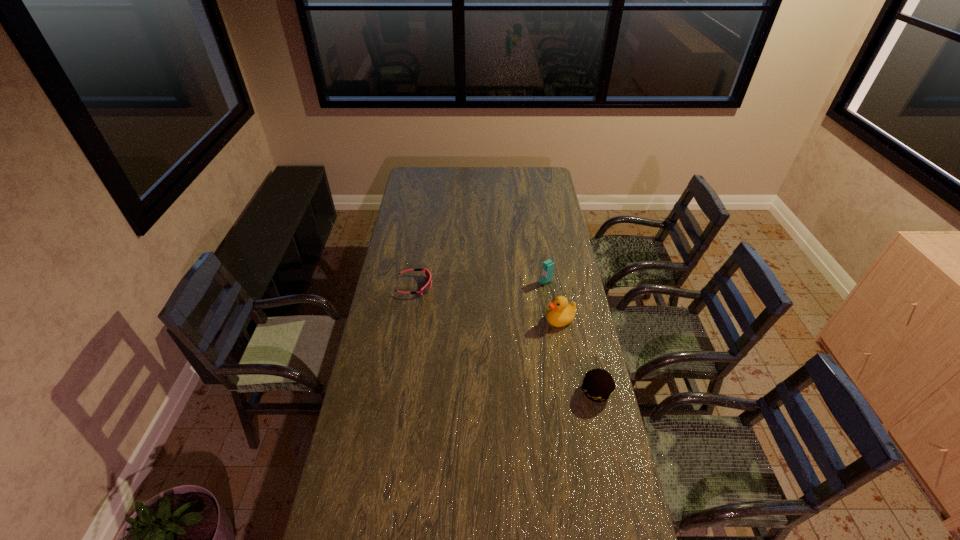
I want to click on the leftmost object, so click(x=426, y=288).

This screenshot has height=540, width=960. Find the location of `the shortest object`. the shortest object is located at coordinates (426, 288).

What are the coordinates of `patty` in the screenshot? It's located at (598, 385).

Identify the location of the second shortest object. This screenshot has width=960, height=540. tap(598, 385).

Find the location of a particular element. duck is located at coordinates (560, 313).

This screenshot has width=960, height=540. What are the coordinates of `the second tallest object` in the screenshot? It's located at (560, 313).

The width and height of the screenshot is (960, 540). In order to click on the tallest object in this screenshot , I will do `click(548, 266)`.

Find the location of a particular element. Image resolution: width=960 pixels, height=540 pixels. free space located 0.330m on the front-facing side of the leftmost object is located at coordinates (504, 286).

Where is `vacant space located 0.050m on the back of the nearest object`? vacant space located 0.050m on the back of the nearest object is located at coordinates (590, 367).

Image resolution: width=960 pixels, height=540 pixels. Identify the location of vacant space located 0.130m at the beak of the third shortest object. (519, 334).